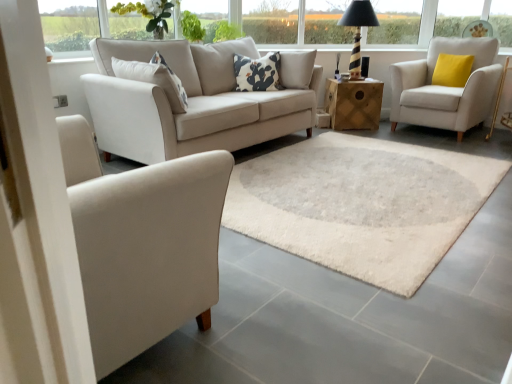
Question: From a real-world perspective, is wooden cube at center above or below green leafy plant at upper center?

Choices:
 (A) above
 (B) below

Answer: (B)

Question: Relative to green leafy plant at upper center, is wooden cube at center in front or behind?

Choices:
 (A) behind
 (B) front

Answer: (A)

Question: Which object is positioned farthest from the yellow fabric pillow at right, which is counted as the second pillow, starting from the left?

Choices:
 (A) matte white armchair at left, placed as the 2th chair when sorted from right to left
 (B) white fabric armchair at right, which is the 1th chair from top to bottom
 (C) striped wood table lamp at upper center
 (D) green leafy plant at upper center
 (E) transparent glass window at upper center

Answer: (A)

Question: Estimate the real-world distances between objects in this image. Which object is farther from the white fabric armchair at right, which appears as the 2th chair when ordered from the bottom?

Choices:
 (A) transparent glass window at upper center
 (B) transparent glass window at upper left, positioned as the 2th window in right-to-left order
 (C) transparent glass window at upper center, marked as the 1th window in a right-to-left arrangement
 (D) yellow fabric pillow at right, marked as the second pillow in a front-to-back arrangement
 (E) green leafy plant at upper center

Answer: (B)